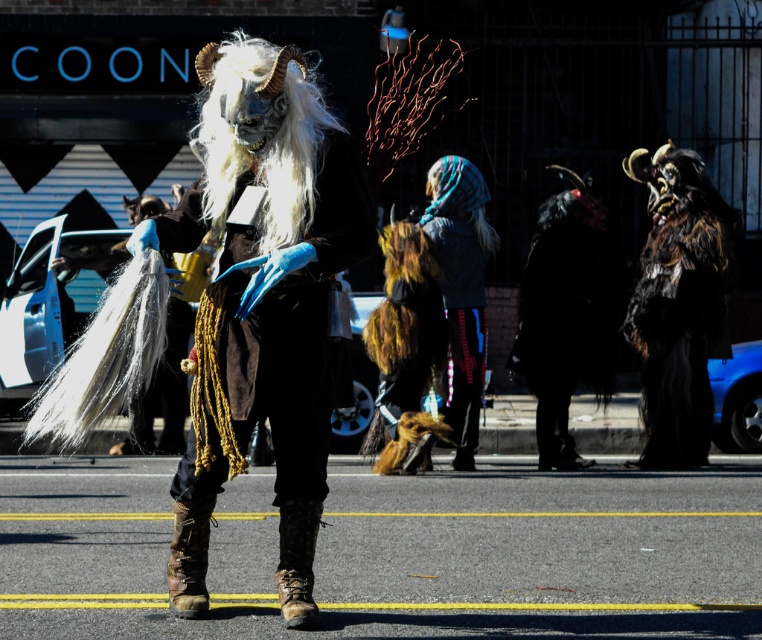
You are a photographer trying to capture the shiny silver mask at center and the brown leather cowboy boot at lower center in the same frame. Given that the mask is larger than the boot, which object should you focus on first to ensure both are clearly visible in your photo?

The shiny silver mask at center is larger in size than the brown leather cowboy boot at lower center, so you should focus on the shiny silver mask at center first to ensure its details are sharp while the boot will still be in the frame due to its smaller size.

You are a costume designer trying to determine the placement of accessories for a new character. Given the scene, which object is shorter in height between the white woolen wig at center and the brown leather cowboy boot at lower center?

The white woolen wig at center is shorter than the brown leather cowboy boot at lower center.